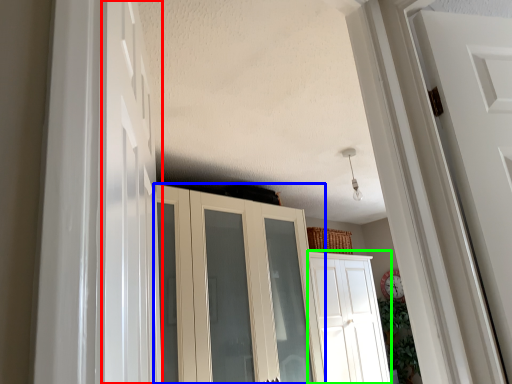
Question: Based on their relative distances, which object is nearer to door (highlighted by a red box)? Choose from cupboard (highlighted by a blue box) and door (highlighted by a green box).

Choices:
 (A) cupboard
 (B) door

Answer: (A)